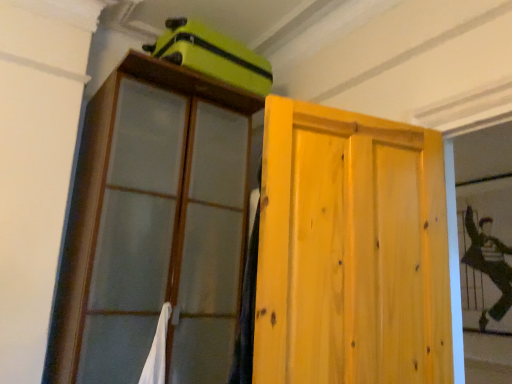
Question: Is light wood door at center taller or shorter than matte green suitcase at upper center?

Choices:
 (A) tall
 (B) short

Answer: (A)

Question: Is light wood door at center to the left or to the right of matte green suitcase at upper center in the image?

Choices:
 (A) right
 (B) left

Answer: (A)

Question: Which of these objects is positioned farthest from the matte green suitcase at upper center?

Choices:
 (A) wooden cabinet at upper left
 (B) light wood door at center
 (C) silky black fabric at right

Answer: (C)

Question: Estimate the real-world distances between objects in this image. Which object is closer to the silky black fabric at right?

Choices:
 (A) light wood door at center
 (B) matte green suitcase at upper center
 (C) wooden cabinet at upper left

Answer: (A)